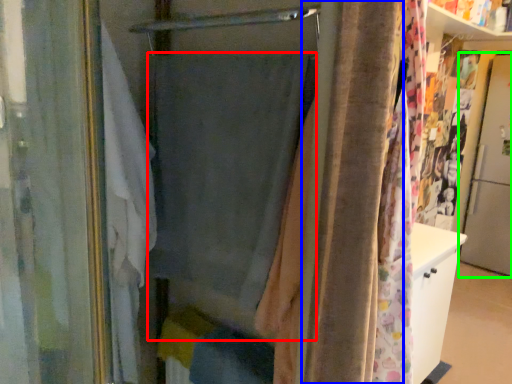
Question: Which is farther away from curtain (highlighted by a red box)? shower curtain (highlighted by a blue box) or screen door (highlighted by a green box)?

Choices:
 (A) shower curtain
 (B) screen door

Answer: (B)